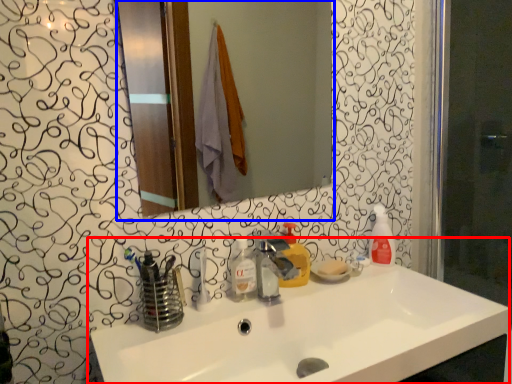
Question: Which point is further to the camera, sink (highlighted by a red box) or mirror (highlighted by a blue box)?

Choices:
 (A) sink
 (B) mirror

Answer: (B)